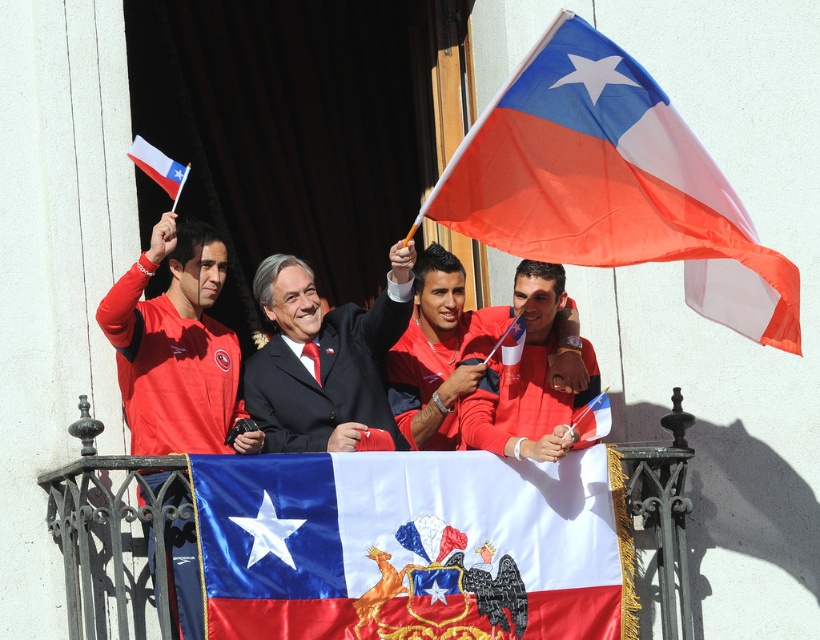
Is point (577, 552) positioned behind point (153, 172)?

No.

Who is taller, matte fabric flag at center or white fabric flag at upper left?

matte fabric flag at center is taller.

The image size is (820, 640). Describe the element at coordinates (410, 547) in the screenshot. I see `matte fabric flag at center` at that location.

Locate an element on the screen. matte fabric flag at center is located at coordinates (410, 547).

Who is lower down, matte black suit at center or matte red shirt at center?

matte red shirt at center is below.

Does matte black suit at center have a greater width compared to matte red shirt at center?

Incorrect, matte black suit at center's width does not surpass matte red shirt at center's.

Between point (377, 337) and point (465, 433), which one is positioned in front?

Positioned in front is point (465, 433).

Locate an element on the screen. This screenshot has height=640, width=820. matte black suit at center is located at coordinates (326, 358).

Is matte orange flag at upper right positioned in front of matte black suit at center?

Yes, it is.

You are a GUI agent. You are given a task and a screenshot of the screen. Output one action in this format:
    pyautogui.click(x=<x>, y=<y>)
    Task: Click on the matte orange flag at upper right
    This screenshot has height=640, width=820.
    Given the screenshot: What is the action you would take?
    pyautogui.click(x=611, y=184)

Find the location of a particular element. The width and height of the screenshot is (820, 640). matte orange flag at upper right is located at coordinates (611, 184).